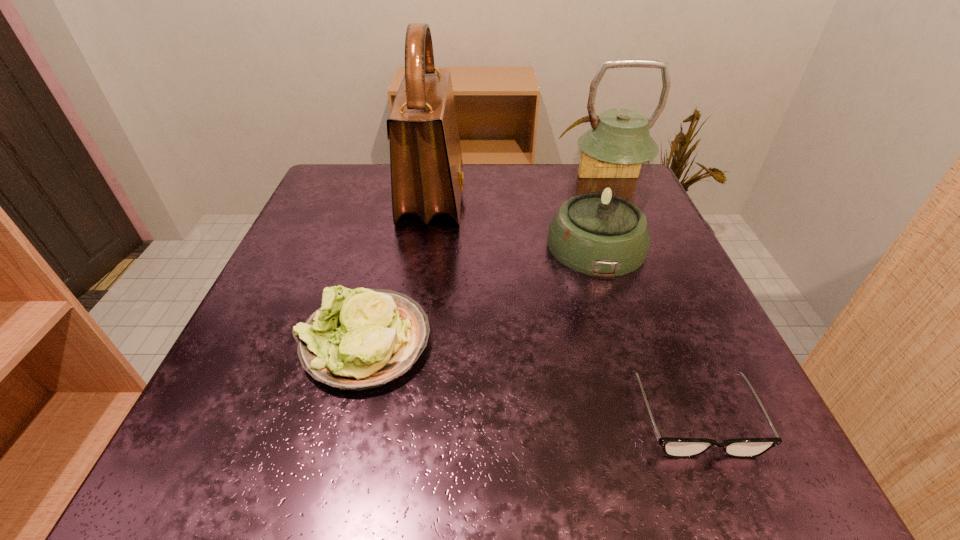
This screenshot has width=960, height=540. Identify the location of free space at the near left corner. (253, 449).

Locate an element on the screen. Image resolution: width=960 pixels, height=540 pixels. blank space at the near right corner of the desktop is located at coordinates (767, 468).

Locate an element on the screen. free spot between the lantern and the spectacles is located at coordinates (646, 330).

Image resolution: width=960 pixels, height=540 pixels. Identify the location of empty space that is in between the shortest object and the lettuce. (530, 379).

Locate an element on the screen. The width and height of the screenshot is (960, 540). empty space between the lantern and the spectacles is located at coordinates (646, 330).

This screenshot has height=540, width=960. In order to click on object that is the third closest to the shoulder bag in this screenshot , I will do `click(673, 447)`.

Locate an element on the screen. Image resolution: width=960 pixels, height=540 pixels. object that is the closest to the second shortest object is located at coordinates (427, 178).

Locate an element on the screen. This screenshot has width=960, height=540. vacant space that satisfies the following two spatial constraints: 1. on the back side of the third tallest object; 2. on the right side of the lantern is located at coordinates (389, 244).

Where is `free space that satisfies the following two spatial constraints: 1. on the back side of the lantern; 2. on the front flap of the shoulder bag`? The width and height of the screenshot is (960, 540). free space that satisfies the following two spatial constraints: 1. on the back side of the lantern; 2. on the front flap of the shoulder bag is located at coordinates (581, 197).

At what (x,y) coordinates should I click in order to perform the action: click on vacant point that satisfies the following two spatial constraints: 1. on the front flap of the shoulder bag; 2. on the right side of the lantern. Please return your answer as a coordinate pair (x, y). Image resolution: width=960 pixels, height=540 pixels. Looking at the image, I should click on (426, 244).